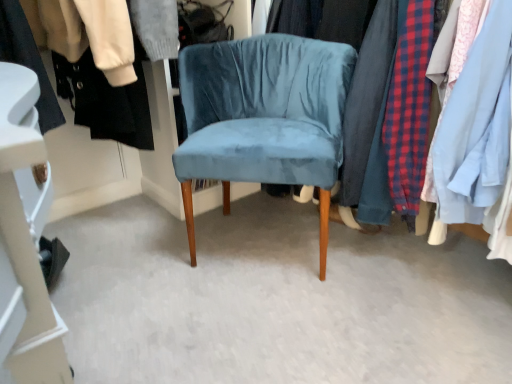
Question: Is black fabric shoe at lower left, positioned as the 2th closet in right-to-left order, aimed at velvet fabric clothes at center, positioned as the first closet in right-to-left order?

Choices:
 (A) yes
 (B) no

Answer: (B)

Question: From a real-world perspective, is black fabric shoe at lower left, positioned as the 2th closet in right-to-left order, below velvet fabric clothes at center, the second closet from the left?

Choices:
 (A) no
 (B) yes

Answer: (B)

Question: Is black fabric shoe at lower left, positioned as the 2th closet in right-to-left order, shorter than velvet fabric clothes at center, positioned as the first closet in right-to-left order?

Choices:
 (A) yes
 (B) no

Answer: (A)

Question: Is black fabric shoe at lower left, positioned as the 2th closet in right-to-left order, smaller than velvet fabric clothes at center, the second closet from the left?

Choices:
 (A) no
 (B) yes

Answer: (B)

Question: Can you confirm if black fabric shoe at lower left, positioned as the 2th closet in right-to-left order, is positioned to the right of velvet fabric clothes at center, the second closet from the left?

Choices:
 (A) no
 (B) yes

Answer: (A)

Question: Does point (230, 112) appear closer or farther from the camera than point (463, 142)?

Choices:
 (A) farther
 (B) closer

Answer: (A)

Question: From the image's perspective, is velvet blue chair at center located above or below velvet fabric clothes at center, the second closet from the left?

Choices:
 (A) above
 (B) below

Answer: (B)

Question: Which is correct: velvet blue chair at center is inside velvet fabric clothes at center, the second closet from the left, or outside of it?

Choices:
 (A) inside
 (B) outside

Answer: (B)

Question: In the image, is velvet blue chair at center on the left side or the right side of velvet fabric clothes at center, the second closet from the left?

Choices:
 (A) right
 (B) left

Answer: (B)

Question: In the image, is velvet fabric clothes at center, positioned as the first closet in right-to-left order, positioned in front of or behind velvet blue chair at center?

Choices:
 (A) behind
 (B) front

Answer: (B)

Question: Looking at their shapes, would you say velvet fabric clothes at center, positioned as the first closet in right-to-left order, is wider or thinner than velvet blue chair at center?

Choices:
 (A) wide
 (B) thin

Answer: (A)

Question: Based on their sizes in the image, would you say velvet fabric clothes at center, the second closet from the left, is bigger or smaller than velvet blue chair at center?

Choices:
 (A) big
 (B) small

Answer: (A)

Question: From the image's perspective, is velvet fabric clothes at center, positioned as the first closet in right-to-left order, positioned above or below velvet blue chair at center?

Choices:
 (A) above
 (B) below

Answer: (A)

Question: In the image, is black fabric shoe at lower left, positioned as the 2th closet in right-to-left order, on the left side or the right side of velvet blue chair at center?

Choices:
 (A) left
 (B) right

Answer: (A)

Question: Do you think black fabric shoe at lower left, positioned as the 2th closet in right-to-left order, is within velvet blue chair at center, or outside of it?

Choices:
 (A) outside
 (B) inside

Answer: (A)